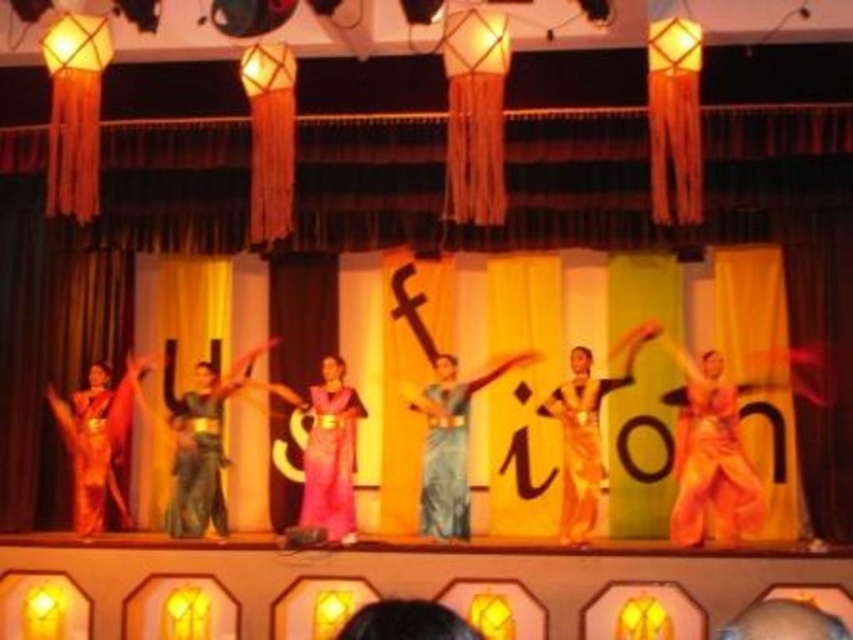
Question: Which object is farther from the camera taking this photo?

Choices:
 (A) orange fabric at center
 (B) blue silk saree at center
 (C) matte green saree at center

Answer: (C)

Question: Which of the following is the closest to the observer?

Choices:
 (A) (563, 442)
 (B) (115, 474)
 (C) (207, 442)

Answer: (A)

Question: Is matte gold saree at left closer to camera compared to orange silk saree at center?

Choices:
 (A) yes
 (B) no

Answer: (B)

Question: Is orange fabric at center below blue silk saree at center?

Choices:
 (A) no
 (B) yes

Answer: (B)

Question: Does orange fabric at center appear on the right side of blue silk saree at center?

Choices:
 (A) no
 (B) yes

Answer: (B)

Question: Estimate the real-world distances between objects in this image. Which object is closer to the matte green saree at center?

Choices:
 (A) orange silk saree at center
 (B) blue silk saree at center

Answer: (B)